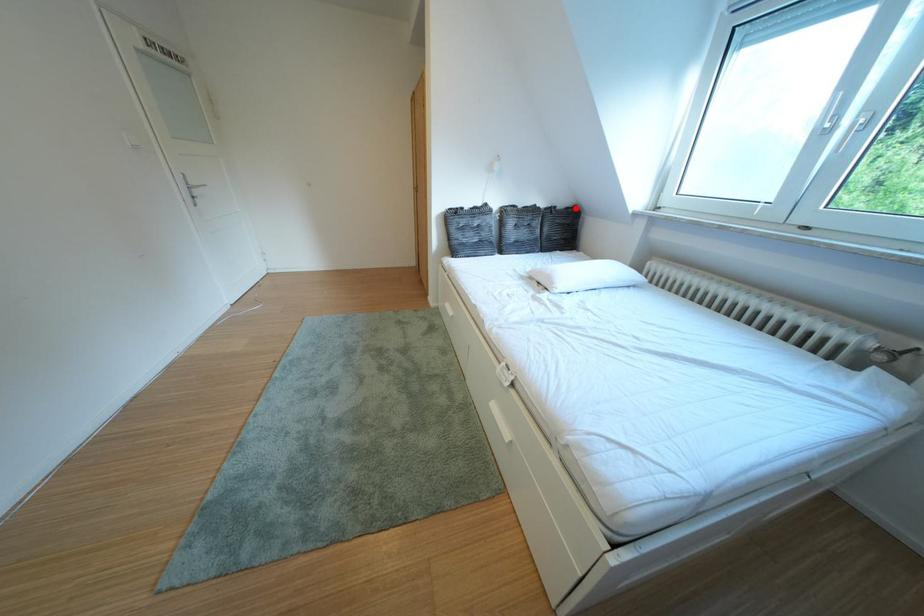
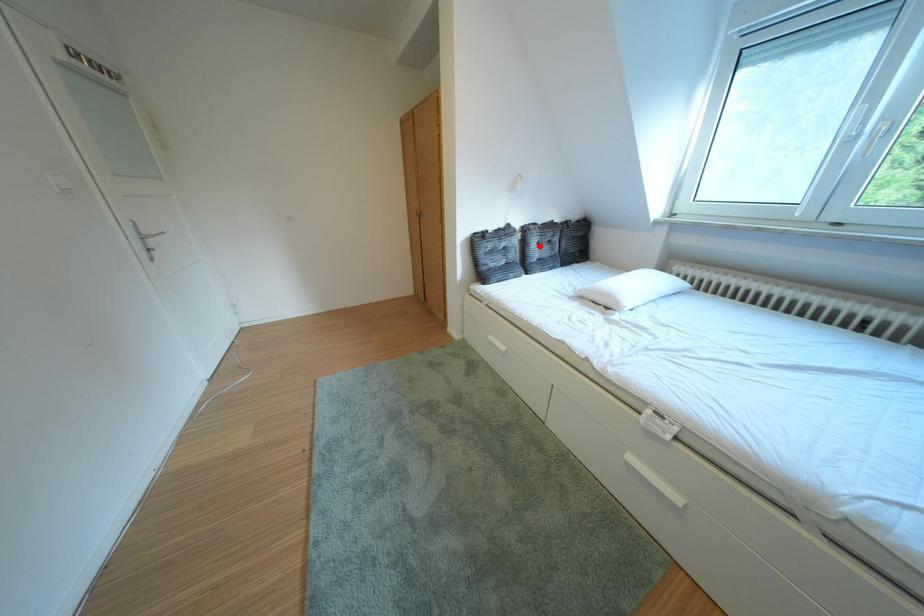
Looking at this image, I am providing you with two images of the same scene from different viewpoints. A red point is marked on the first image and another point is marked on the second image. Is the red point in image1 aligned with the point shown in image2?

No